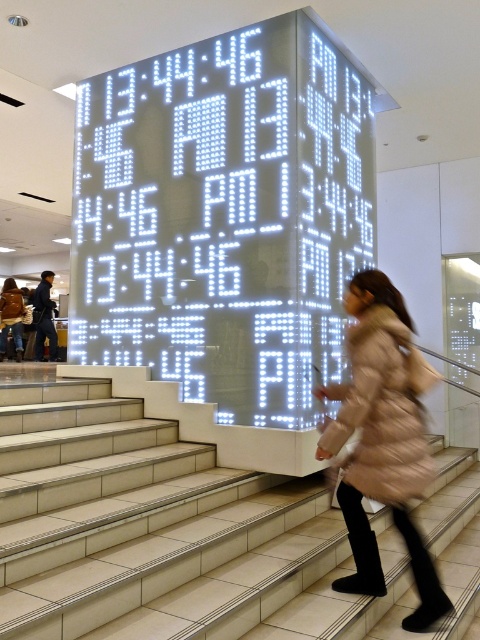
You are standing at the bottom of the staircase in the shopping mall and see two points marked on the floor. The first point is labeled as point (330, 440) and the second is point (39, 321). If you want to walk towards the point that is closer to the illuminated digital clock installation above the staircase, which point should you walk towards?

Point (330, 440) is in front of point (39, 321), so it is closer to the illuminated digital clock installation above the staircase. Therefore, you should walk towards point (330, 440).

You are standing at the point marked as point (50, 332) in a modern indoor setting with a large digital clock above a staircase. You want to move to the staircase below the clock. Is the staircase within a safe distance for you to walk to without needing assistance?

The distance between you and the staircase is 8.58 meters, which is a safe distance for walking without assistance.

You are an observer standing at the bottom of the staircase in the shopping mall. You see a beige fur coat at right and a dark blue jeans at left. Which clothing item is positioned lower in the image?

The beige fur coat at right is located below dark blue jeans at left, so the beige fur coat at right is positioned lower in the image.